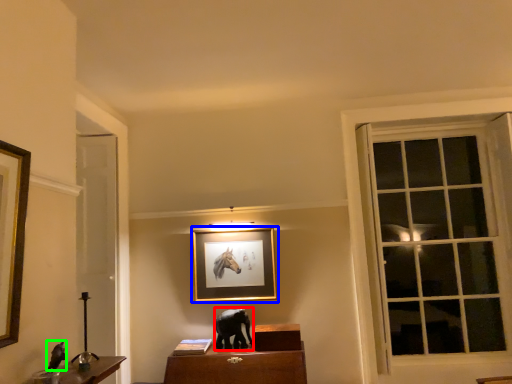
Question: Estimate the real-world distances between objects in this image. Which object is closer to animal (highlighted by a red box), picture frame (highlighted by a blue box) or animal (highlighted by a green box)?

Choices:
 (A) picture frame
 (B) animal

Answer: (A)